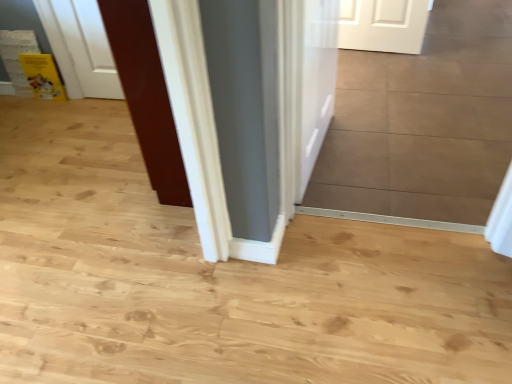
What do you see at coordinates (317, 81) in the screenshot? I see `white glossy door at center, which appears as the 1th door when viewed from the right` at bounding box center [317, 81].

Where is `white glossy door at center, which is the second door from left to right`? Image resolution: width=512 pixels, height=384 pixels. white glossy door at center, which is the second door from left to right is located at coordinates (317, 81).

Measure the distance between point [169,125] and camera.

They are 5.25 feet apart.

Describe the element at coordinates (146, 96) in the screenshot. I see `glossy wood door at center, arranged as the first door when viewed from the left` at that location.

This screenshot has height=384, width=512. In order to click on glossy wood door at center, arranged as the first door when viewed from the left in this screenshot , I will do `click(146, 96)`.

Measure the distance between glossy wood door at center, which is the 2th door in right-to-left order, and camera.

glossy wood door at center, which is the 2th door in right-to-left order, is 4.19 feet away from camera.

At what (x,y) coordinates should I click in order to perform the action: click on white glossy door at center, which is the second door from left to right. Please return your answer as a coordinate pair (x, y). Looking at the image, I should click on (317, 81).

Looking at this image, is white glossy door at center, which is the second door from left to right, to the left of glossy wood door at center, which is the 2th door in right-to-left order, from the viewer's perspective?

In fact, white glossy door at center, which is the second door from left to right, is to the right of glossy wood door at center, which is the 2th door in right-to-left order.

Which object is further away from the camera taking this photo, white glossy door at center, which appears as the 1th door when viewed from the right, or glossy wood door at center, arranged as the first door when viewed from the left?

glossy wood door at center, arranged as the first door when viewed from the left, is further from the camera.

Which point is more distant from viewer, (302, 116) or (140, 54)?

Positioned behind is point (302, 116).

From the picture: From the image's perspective, which object appears higher, white glossy door at center, which appears as the 1th door when viewed from the right, or glossy wood door at center, arranged as the first door when viewed from the left?

white glossy door at center, which appears as the 1th door when viewed from the right.

From a real-world perspective, is white glossy door at center, which appears as the 1th door when viewed from the right, beneath glossy wood door at center, arranged as the first door when viewed from the left?

Yes, from a real-world perspective, white glossy door at center, which appears as the 1th door when viewed from the right, is below glossy wood door at center, arranged as the first door when viewed from the left.

Is white glossy door at center, which is the second door from left to right, wider than glossy wood door at center, which is the 2th door in right-to-left order?

In fact, white glossy door at center, which is the second door from left to right, might be narrower than glossy wood door at center, which is the 2th door in right-to-left order.

Considering the sizes of white glossy door at center, which appears as the 1th door when viewed from the right, and glossy wood door at center, which is the 2th door in right-to-left order, in the image, is white glossy door at center, which appears as the 1th door when viewed from the right, taller or shorter than glossy wood door at center, which is the 2th door in right-to-left order,?

white glossy door at center, which appears as the 1th door when viewed from the right, is shorter than glossy wood door at center, which is the 2th door in right-to-left order.

Between white glossy door at center, which is the second door from left to right, and glossy wood door at center, which is the 2th door in right-to-left order, which one has smaller size?

white glossy door at center, which is the second door from left to right.

Is glossy wood door at center, which is the 2th door in right-to-left order, completely or partially inside white glossy door at center, which is the second door from left to right?

That's incorrect, glossy wood door at center, which is the 2th door in right-to-left order, is not inside white glossy door at center, which is the second door from left to right.

Is white glossy door at center, which appears as the 1th door when viewed from the right, beside glossy wood door at center, which is the 2th door in right-to-left order?

white glossy door at center, which appears as the 1th door when viewed from the right, and glossy wood door at center, which is the 2th door in right-to-left order, are clearly separated.

Is white glossy door at center, which appears as the 1th door when viewed from the right, oriented away from glossy wood door at center, which is the 2th door in right-to-left order?

Yes.

What's the angular difference between white glossy door at center, which appears as the 1th door when viewed from the right, and glossy wood door at center, which is the 2th door in right-to-left order,'s facing directions?

The angular difference between white glossy door at center, which appears as the 1th door when viewed from the right, and glossy wood door at center, which is the 2th door in right-to-left order, is 175 degrees.

Where is `door on the right of glossy wood door at center, which is the 2th door in right-to-left order`? The height and width of the screenshot is (384, 512). door on the right of glossy wood door at center, which is the 2th door in right-to-left order is located at coordinates (317, 81).

Is glossy wood door at center, which is the 2th door in right-to-left order, at the left side of white glossy door at center, which is the second door from left to right?

Indeed, glossy wood door at center, which is the 2th door in right-to-left order, is positioned on the left side of white glossy door at center, which is the second door from left to right.

In the image, is glossy wood door at center, which is the 2th door in right-to-left order, positioned in front of or behind white glossy door at center, which is the second door from left to right?

Clearly, glossy wood door at center, which is the 2th door in right-to-left order, is behind white glossy door at center, which is the second door from left to right.

Between point (106, 3) and point (308, 29), which one is positioned in front?

Point (106, 3)

From the image's perspective, does glossy wood door at center, which is the 2th door in right-to-left order, appear higher than white glossy door at center, which is the second door from left to right?

No, from the image's perspective, glossy wood door at center, which is the 2th door in right-to-left order, is not on top of white glossy door at center, which is the second door from left to right.

From a real-world perspective, is glossy wood door at center, arranged as the first door when viewed from the left, physically located above or below white glossy door at center, which is the second door from left to right?

glossy wood door at center, arranged as the first door when viewed from the left, is above white glossy door at center, which is the second door from left to right.

Looking at their sizes, would you say glossy wood door at center, arranged as the first door when viewed from the left, is wider or thinner than white glossy door at center, which appears as the 1th door when viewed from the right?

glossy wood door at center, arranged as the first door when viewed from the left, is wider than white glossy door at center, which appears as the 1th door when viewed from the right.

Is glossy wood door at center, which is the 2th door in right-to-left order, taller than white glossy door at center, which appears as the 1th door when viewed from the right?

Yes.

Considering the relative sizes of glossy wood door at center, arranged as the first door when viewed from the left, and white glossy door at center, which appears as the 1th door when viewed from the right, in the image provided, is glossy wood door at center, arranged as the first door when viewed from the left, smaller than white glossy door at center, which appears as the 1th door when viewed from the right,?

Incorrect, glossy wood door at center, arranged as the first door when viewed from the left, is not smaller in size than white glossy door at center, which appears as the 1th door when viewed from the right.

Consider the image. Would you say glossy wood door at center, arranged as the first door when viewed from the left, contains white glossy door at center, which is the second door from left to right?

That's incorrect, white glossy door at center, which is the second door from left to right, is not inside glossy wood door at center, arranged as the first door when viewed from the left.

Is glossy wood door at center, which is the 2th door in right-to-left order, with white glossy door at center, which is the second door from left to right?

No, glossy wood door at center, which is the 2th door in right-to-left order, is not beside white glossy door at center, which is the second door from left to right.

Does glossy wood door at center, which is the 2th door in right-to-left order, turn towards white glossy door at center, which is the second door from left to right?

No, glossy wood door at center, which is the 2th door in right-to-left order, is not turned towards white glossy door at center, which is the second door from left to right.

How many degrees apart are the facing directions of glossy wood door at center, arranged as the first door when viewed from the left, and white glossy door at center, which appears as the 1th door when viewed from the right?

175 degrees.

Locate an element on the screen. door in front of the glossy wood door at center, which is the 2th door in right-to-left order is located at coordinates (317, 81).

The image size is (512, 384). I want to click on door above the glossy wood door at center, which is the 2th door in right-to-left order (from the image's perspective), so click(x=317, y=81).

Identify the location of door lying in front of the glossy wood door at center, which is the 2th door in right-to-left order. The height and width of the screenshot is (384, 512). (317, 81).